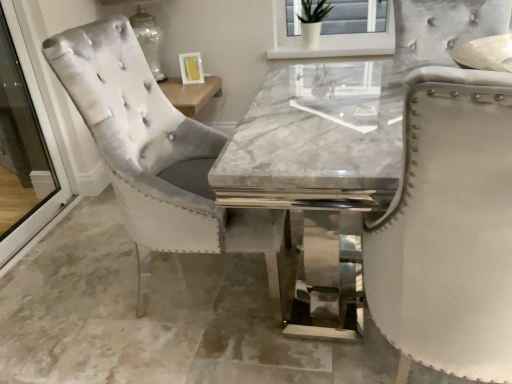
Identify the location of free spot in front of clear glass screen door at left. The height and width of the screenshot is (384, 512). (40, 275).